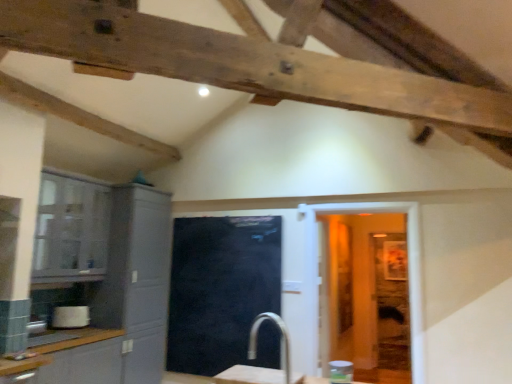
Question: Does matte gray cabinet at left, acting as the third cabinetry starting from the front, appear on the right side of black glass door at center?

Choices:
 (A) yes
 (B) no

Answer: (B)

Question: From the image's perspective, does matte gray cabinet at left, acting as the third cabinetry starting from the front, appear higher than black glass door at center?

Choices:
 (A) no
 (B) yes

Answer: (B)

Question: Does matte gray cabinet at left, positioned as the first cabinetry in back-to-front order, appear on the left side of black glass door at center?

Choices:
 (A) yes
 (B) no

Answer: (A)

Question: From a real-world perspective, is matte gray cabinet at left, acting as the third cabinetry starting from the front, physically below black glass door at center?

Choices:
 (A) no
 (B) yes

Answer: (A)

Question: Is matte gray cabinet at left, positioned as the first cabinetry in back-to-front order, positioned before black glass door at center?

Choices:
 (A) yes
 (B) no

Answer: (A)

Question: Would you say white marble table at center is to the left or to the right of clear plastic jar at lower right, placed as the 2th appliance when sorted from left to right, in the picture?

Choices:
 (A) right
 (B) left

Answer: (B)

Question: Is white marble table at center wider or thinner than clear plastic jar at lower right, which is the 2th appliance in back-to-front order?

Choices:
 (A) thin
 (B) wide

Answer: (B)

Question: From a real-world perspective, is white marble table at center above or below clear plastic jar at lower right, which is the 2th appliance in back-to-front order?

Choices:
 (A) above
 (B) below

Answer: (B)

Question: Relative to clear plastic jar at lower right, placed as the 2th appliance when sorted from left to right, is white marble table at center in front or behind?

Choices:
 (A) front
 (B) behind

Answer: (A)

Question: From the image's perspective, relative to white marble table at center, is matte gray cabinet at lower left, the 1th cabinetry positioned from the front, above or below?

Choices:
 (A) above
 (B) below

Answer: (B)

Question: Looking at the image, does matte gray cabinet at lower left, the third cabinetry when ordered from back to front, seem bigger or smaller compared to white marble table at center?

Choices:
 (A) big
 (B) small

Answer: (A)

Question: From their relative heights in the image, would you say matte gray cabinet at lower left, the 1th cabinetry positioned from the front, is taller or shorter than white marble table at center?

Choices:
 (A) tall
 (B) short

Answer: (A)

Question: In the image, is matte gray cabinet at lower left, the third cabinetry when ordered from back to front, positioned in front of or behind white marble table at center?

Choices:
 (A) behind
 (B) front

Answer: (A)

Question: Does point (73, 367) appear closer or farther from the camera than point (121, 339)?

Choices:
 (A) closer
 (B) farther

Answer: (A)

Question: Based on their sizes in the image, would you say matte gray cabinet at lower left, the 1th cabinetry positioned from the front, is bigger or smaller than matte gray cabinet at left, acting as the third cabinetry starting from the front?

Choices:
 (A) big
 (B) small

Answer: (B)